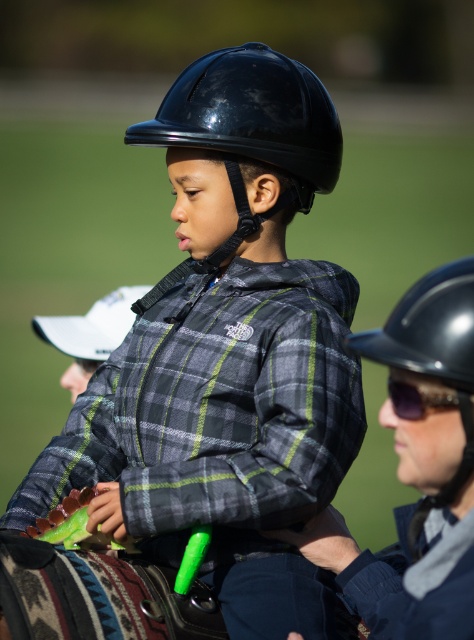
You are standing in front of the image and want to determine which of the two points, point (135, 534) or point (404, 348), is closer to you. Based on the scene description, which point is closer?

Point (135, 534) is closer to you because it is further to the viewer than point (404, 348) according to the description.

You are standing in front of the image and want to determine which of the two points, point (218,131) or point (443,404), is closer to you. Based on the spatial relationship between them, which point is nearer?

Point (218,131) is further to the camera than point (443,404), so the point closer to you is point (443,404).